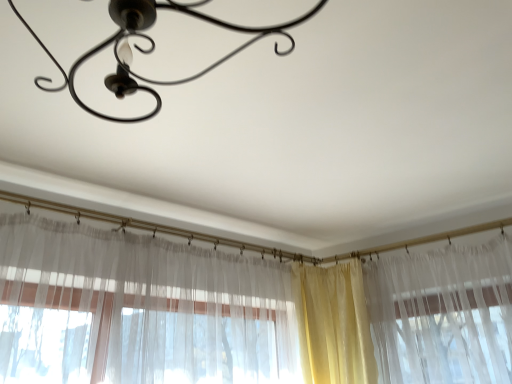
Locate an element on the screen. yellow sheer curtain at center is located at coordinates (333, 324).

This screenshot has height=384, width=512. What do you see at coordinates (333, 324) in the screenshot? I see `yellow sheer curtain at center` at bounding box center [333, 324].

Measure the distance between yellow sheer curtain at center and camera.

yellow sheer curtain at center is 2.23 meters away from camera.

At what (x,y) coordinates should I click in order to perform the action: click on metallic chandelier at upper center. Please return your answer as a coordinate pair (x, y). This screenshot has height=384, width=512. Looking at the image, I should click on (152, 48).

The height and width of the screenshot is (384, 512). Describe the element at coordinates (152, 48) in the screenshot. I see `metallic chandelier at upper center` at that location.

Find the location of a particular element. This screenshot has width=512, height=384. yellow sheer curtain at center is located at coordinates (333, 324).

Can you confirm if yellow sheer curtain at center is positioned to the right of metallic chandelier at upper center?

Correct, you'll find yellow sheer curtain at center to the right of metallic chandelier at upper center.

Considering the positions of objects yellow sheer curtain at center and metallic chandelier at upper center in the image provided, who is in front, yellow sheer curtain at center or metallic chandelier at upper center?

metallic chandelier at upper center.

Is point (334, 265) closer or farther from the camera than point (115, 118)?

Point (334, 265) is farther from the camera than point (115, 118).

From the image's perspective, is yellow sheer curtain at center positioned above or below metallic chandelier at upper center?

Clearly, from the image's perspective, yellow sheer curtain at center is below metallic chandelier at upper center.

From a real-world perspective, is yellow sheer curtain at center on metallic chandelier at upper center?

No, from a real-world perspective, yellow sheer curtain at center is not over metallic chandelier at upper center

Considering the sizes of objects yellow sheer curtain at center and metallic chandelier at upper center in the image provided, who is wider, yellow sheer curtain at center or metallic chandelier at upper center?

metallic chandelier at upper center.

From their relative heights in the image, would you say yellow sheer curtain at center is taller or shorter than metallic chandelier at upper center?

In the image, yellow sheer curtain at center appears to be taller than metallic chandelier at upper center.

Can you confirm if yellow sheer curtain at center is bigger than metallic chandelier at upper center?

Incorrect, yellow sheer curtain at center is not larger than metallic chandelier at upper center.

Would you say yellow sheer curtain at center is outside metallic chandelier at upper center?

Yes, yellow sheer curtain at center is outside of metallic chandelier at upper center.

Based on the photo, is yellow sheer curtain at center far away from metallic chandelier at upper center?

Yes.

Is yellow sheer curtain at center oriented towards metallic chandelier at upper center?

Yes, yellow sheer curtain at center is facing metallic chandelier at upper center.

This screenshot has height=384, width=512. What are the coordinates of `lamp above the yellow sheer curtain at center (from a real-world perspective)` in the screenshot? It's located at (152, 48).

Between metallic chandelier at upper center and yellow sheer curtain at center, which one appears on the left side from the viewer's perspective?

From the viewer's perspective, metallic chandelier at upper center appears more on the left side.

Which object is further away from the camera, metallic chandelier at upper center or yellow sheer curtain at center?

Positioned behind is yellow sheer curtain at center.

Is point (109, 42) positioned before point (351, 315)?

Yes, point (109, 42) is in front of point (351, 315).

From the image's perspective, is metallic chandelier at upper center on top of yellow sheer curtain at center?

Yes, from the image's perspective, metallic chandelier at upper center is on top of yellow sheer curtain at center.

From a real-world perspective, is metallic chandelier at upper center above or below yellow sheer curtain at center?

In terms of real-world spatial position, metallic chandelier at upper center is above yellow sheer curtain at center.

Is metallic chandelier at upper center wider than yellow sheer curtain at center?

Correct, the width of metallic chandelier at upper center exceeds that of yellow sheer curtain at center.

Considering the sizes of metallic chandelier at upper center and yellow sheer curtain at center in the image, is metallic chandelier at upper center taller or shorter than yellow sheer curtain at center?

In the image, metallic chandelier at upper center appears to be shorter than yellow sheer curtain at center.

Is metallic chandelier at upper center bigger than yellow sheer curtain at center?

Yes.

Choose the correct answer: Is metallic chandelier at upper center inside yellow sheer curtain at center or outside it?

metallic chandelier at upper center is spatially situated outside yellow sheer curtain at center.

Are metallic chandelier at upper center and yellow sheer curtain at center far apart?

Indeed, metallic chandelier at upper center is not near yellow sheer curtain at center.

Is metallic chandelier at upper center facing towards yellow sheer curtain at center?

No.

What's the angular difference between metallic chandelier at upper center and yellow sheer curtain at center's facing directions?

49.5 degrees.

How much distance is there between metallic chandelier at upper center and yellow sheer curtain at center?

A distance of 5.44 feet exists between metallic chandelier at upper center and yellow sheer curtain at center.

Locate an element on the screen. lamp above the yellow sheer curtain at center (from a real-world perspective) is located at coordinates [x=152, y=48].

You are a GUI agent. You are given a task and a screenshot of the screen. Output one action in this format:
    pyautogui.click(x=<x>, y=<y>)
    Task: Click on the lamp in front of the yellow sheer curtain at center
    Image resolution: width=512 pixels, height=384 pixels.
    Given the screenshot: What is the action you would take?
    pyautogui.click(x=152, y=48)

Identify the location of lamp above the yellow sheer curtain at center (from the image's perspective). pyautogui.click(x=152, y=48).